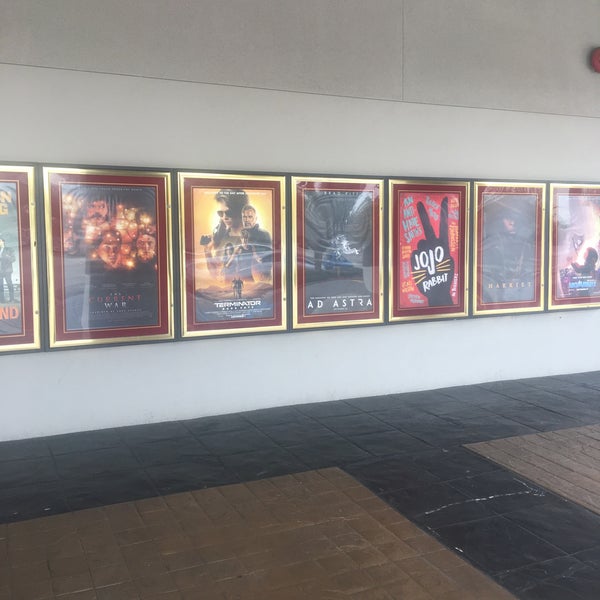
At what (x,y) coordinates should I click in order to perform the action: click on poster frame. Please return your answer as a coordinate pair (x, y). The image size is (600, 600). Looking at the image, I should click on (266, 179).